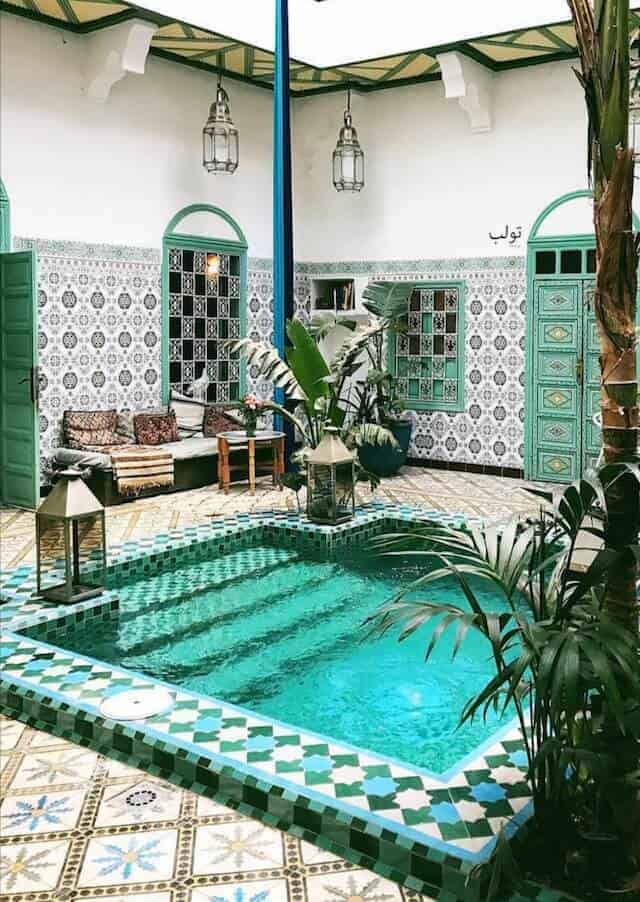
This screenshot has height=902, width=640. Find the location of `table`. table is located at coordinates (235, 437).